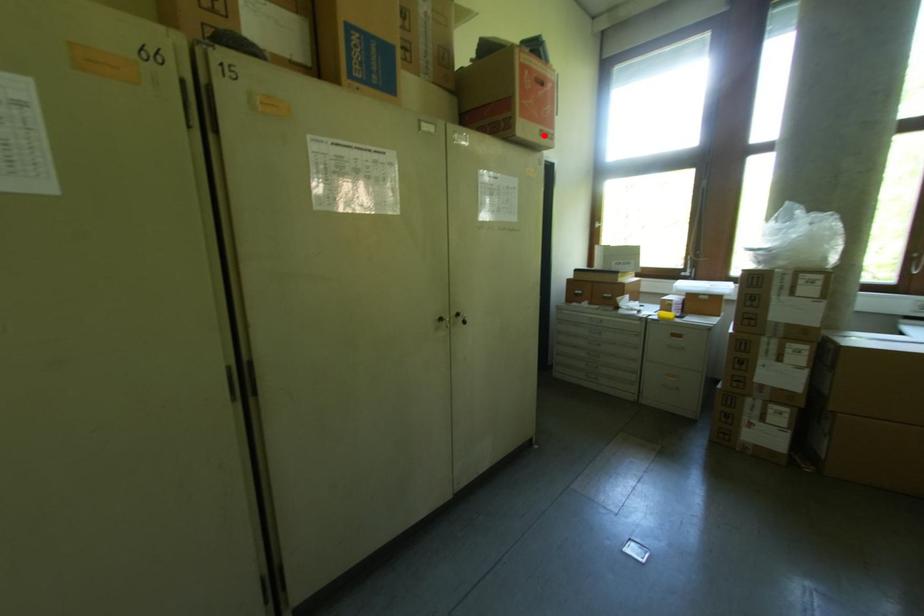
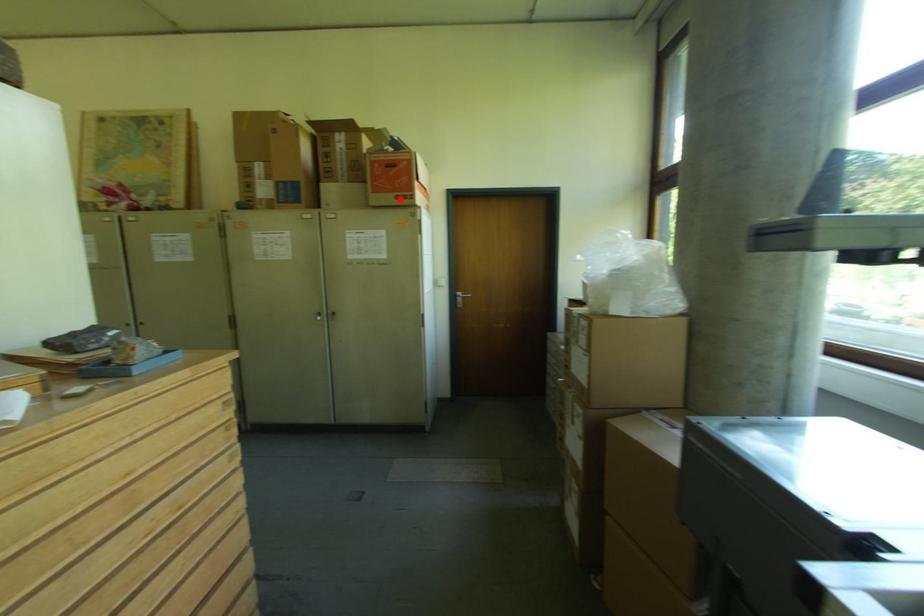
I am providing you with two images of the same scene from different viewpoints. A red point is marked on the first image and another point is marked on the second image. Are the points marked in image1 and image2 representing the same 3D position?

Yes